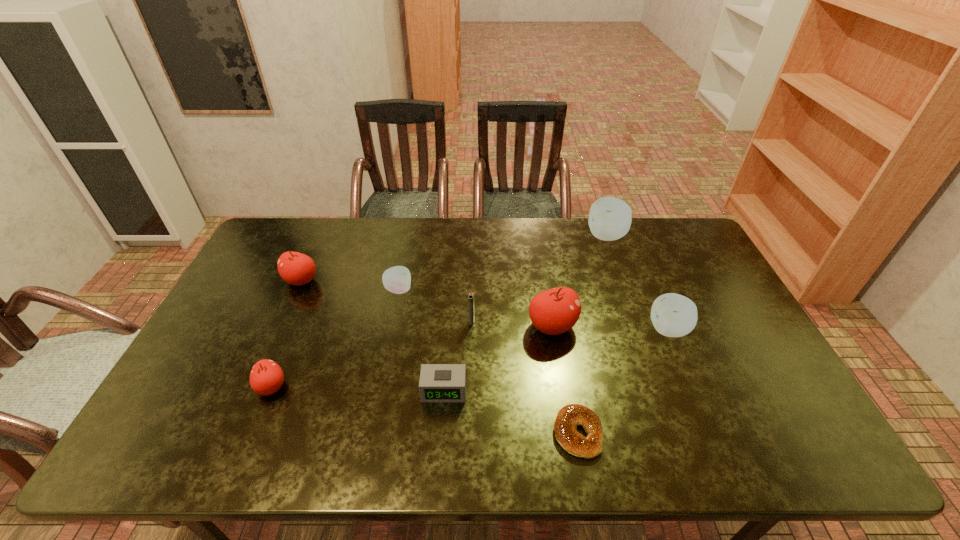
Choose which object is the eighth nearest neighbor to the smallest red apple. Please provide its 2D coordinates. Your answer should be formatted as a tuple, i.e. [(x, y)], where the tuple contains the x and y coordinates of a point satisfying the conditions above.

[(610, 218)]

The width and height of the screenshot is (960, 540). Identify the location of object that is the sixth closest one to the igniter. (295, 268).

The width and height of the screenshot is (960, 540). Identify the location of apple that can be found as the third closest to the tan bagel. (397, 279).

Locate which apple is the fifth closest to the farthest white apple. Please provide its 2D coordinates. Your answer should be formatted as a tuple, i.e. [(x, y)], where the tuple contains the x and y coordinates of a point satisfying the conditions above.

[(266, 377)]

Where is `white apple that is the closest to the second nearest white apple`? The width and height of the screenshot is (960, 540). white apple that is the closest to the second nearest white apple is located at coordinates [x=610, y=218].

This screenshot has height=540, width=960. In order to click on white apple that is the closest to the nearest white apple in this screenshot , I will do `click(610, 218)`.

Where is `the third closest red apple to the seventh object from right to left`? the third closest red apple to the seventh object from right to left is located at coordinates (555, 311).

I want to click on red apple object that ranks as the second closest to the second farthest red apple, so click(x=295, y=268).

Identify the location of free space that satisfies the following two spatial constraints: 1. on the front-facing side of the bagel; 2. on the right side of the sixth object from right to left. (442, 433).

Locate an element on the screen. free location that satisfies the following two spatial constraints: 1. on the front-facing side of the nearest object; 2. on the left side of the alarm clock is located at coordinates (442, 433).